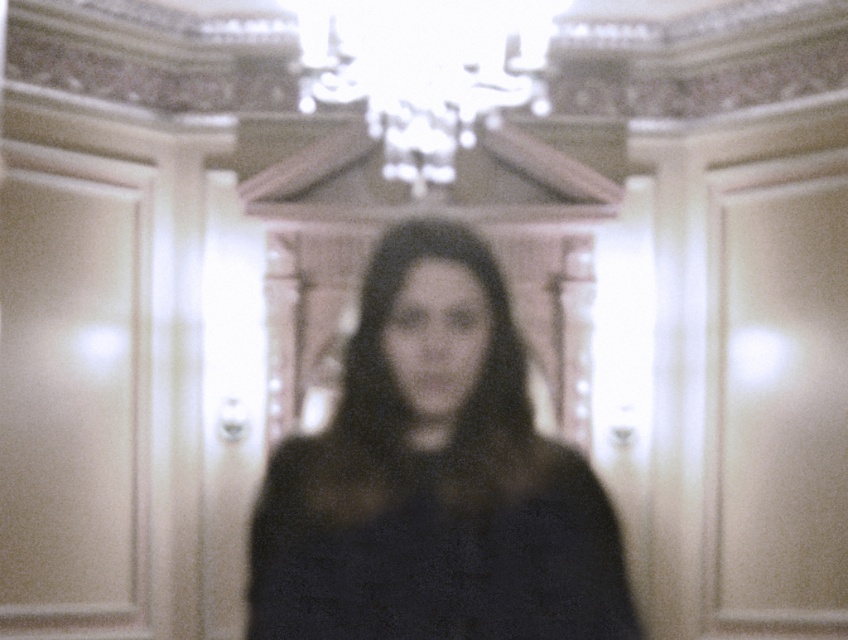
Can you confirm if black matte dress at center is wider than white glass chandelier at upper center?

Incorrect, black matte dress at center's width does not surpass white glass chandelier at upper center's.

Between black matte dress at center and white glass chandelier at upper center, which one is positioned lower?

Positioned lower is black matte dress at center.

Where is `black matte dress at center`? The height and width of the screenshot is (640, 848). black matte dress at center is located at coordinates (434, 477).